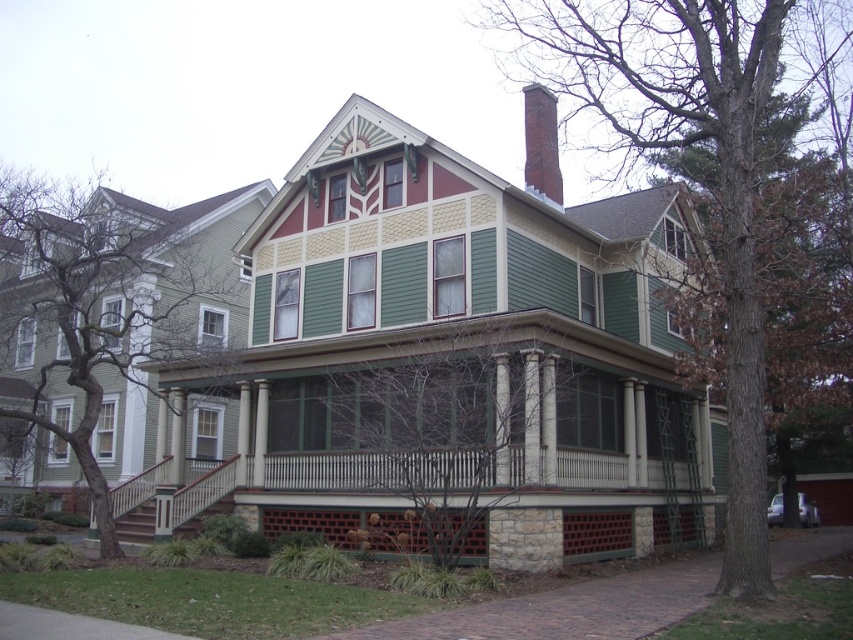
You are a delivery person approaching the Victorian house to drop off a large package. You need to place the package on a surface that can support its weight. Based on the scene, which object between the stone textured porch at lower center and the smooth brick chimney at upper center would be more suitable for placing the heavy package?

The stone textured porch at lower center is more suitable for placing the heavy package because it has a larger size compared to the smooth brick chimney at upper center, making it sturdier and more capable of supporting the weight.

You are standing on the lawn in front of the house and want to place a tall garden statue. The statue is 2 meters tall. The base of the statue requires a flat surface. Which object between the stone textured porch at lower center and the smooth brick chimney at upper center would be suitable for placing the statue?

The stone textured porch at lower center has a lesser height compared to the smooth brick chimney at upper center, so the statue can be placed on the stone textured porch at lower center since it is a flat surface at ground level.